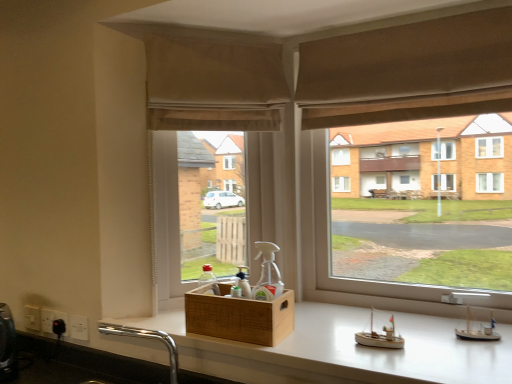
Question: Considering the relative positions of translucent plastic bottle at lower left, the first bottle positioned from the left, and wooden crate at center in the image provided, is translucent plastic bottle at lower left, the first bottle positioned from the left, to the left or to the right of wooden crate at center?

Choices:
 (A) right
 (B) left

Answer: (B)

Question: In terms of height, does translucent plastic bottle at lower left, the second bottle when ordered from right to left, look taller or shorter compared to wooden crate at center?

Choices:
 (A) tall
 (B) short

Answer: (B)

Question: Which object is positioned farthest from the matte brown curtain at center?

Choices:
 (A) brown fabric curtain at upper center
 (B) white glossy counter at center
 (C) transparent plastic spray bottle at center, the first bottle in the right-to-left sequence
 (D) beige fabric window screen at center
 (E) translucent plastic bottle at lower left, the second bottle when ordered from right to left

Answer: (E)

Question: Based on their relative distances, which object is nearer to the transparent plastic spray bottle at center, the first bottle in the right-to-left sequence?

Choices:
 (A) wooden crate at center
 (B) brown fabric curtain at upper center
 (C) matte brown curtain at center
 (D) beige fabric window screen at center
 (E) white glossy counter at center

Answer: (A)